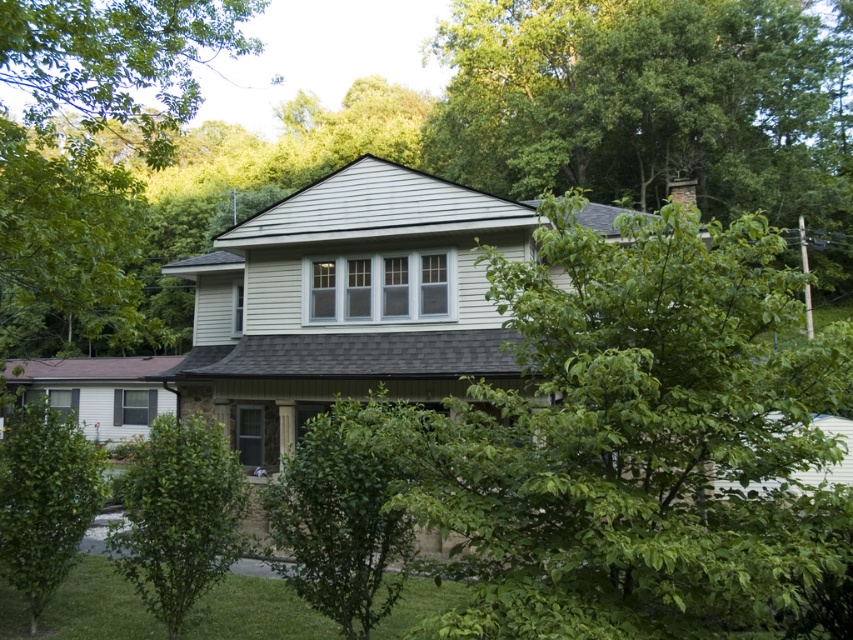
Who is more distant from viewer, (335, 436) or (181, 595)?

The point (181, 595) is more distant.

Is point (328, 548) behind point (167, 483)?

No, (328, 548) is closer to viewer.

Does point (345, 528) lie behind point (146, 572)?

No, (345, 528) is in front of (146, 572).

This screenshot has height=640, width=853. What are the coordinates of `green leafy hedge at center` in the screenshot? It's located at (346, 509).

Describe the element at coordinates (646, 442) in the screenshot. The image size is (853, 640). I see `green leafy tree at center` at that location.

Find the location of a particular element. The width and height of the screenshot is (853, 640). green leafy tree at center is located at coordinates (646, 442).

Based on the photo, can you confirm if green leafy tree at center is positioned above green leafy bush at lower left?

Yes.

Is point (625, 332) farther from viewer compared to point (192, 568)?

That is False.

This screenshot has width=853, height=640. Find the location of `green leafy tree at center`. green leafy tree at center is located at coordinates (646, 442).